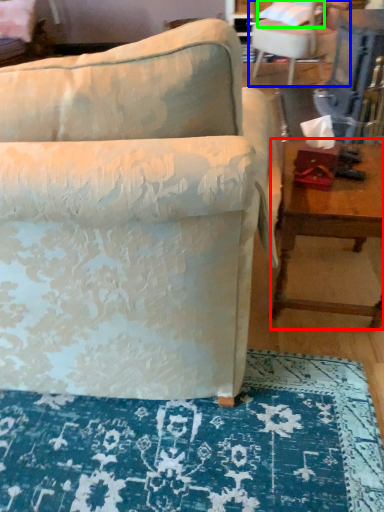
Question: Which is nearer to the table (highlighted by a red box)? chair (highlighted by a blue box) or pillow (highlighted by a green box).

Choices:
 (A) chair
 (B) pillow

Answer: (A)